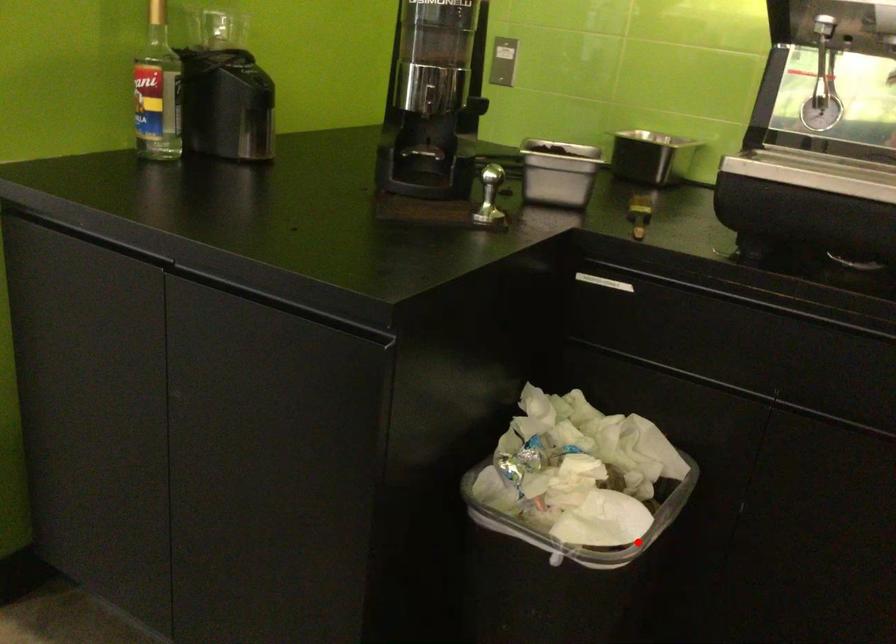
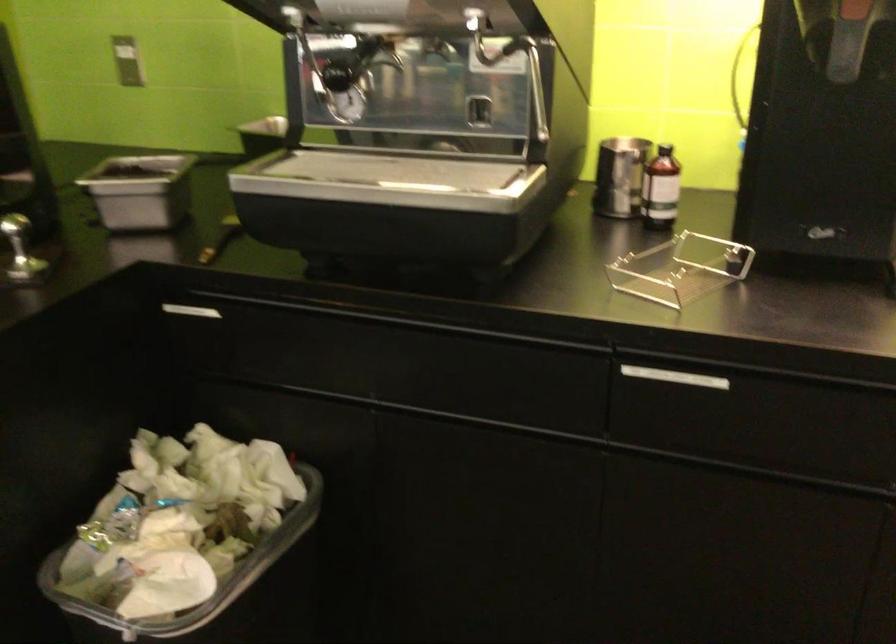
The point at the highlighted location is marked in the first image. Where is the corresponding point in the second image?

(218, 592)